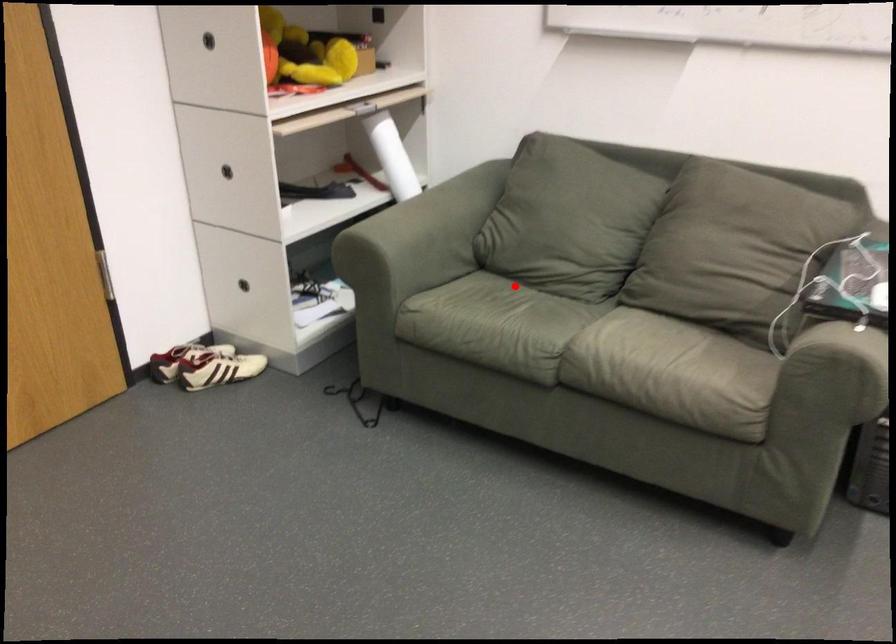
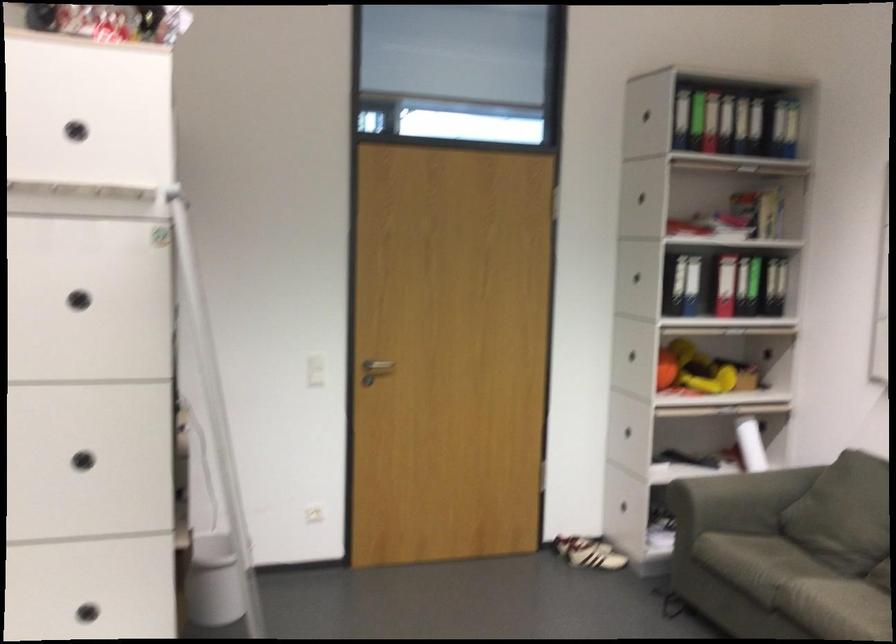
Find the pixel in the second image that matches the highlighted location in the first image.

(787, 550)